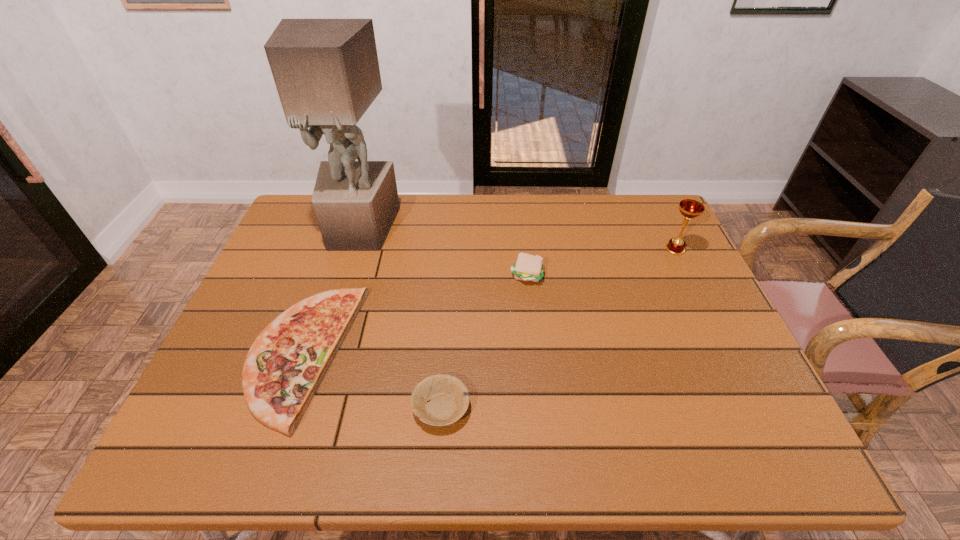
Locate an element on the screen. the tallest object is located at coordinates (326, 71).

Locate an element on the screen. The width and height of the screenshot is (960, 540). the fourth shortest object is located at coordinates (689, 208).

The height and width of the screenshot is (540, 960). What are the coordinates of `chalice` in the screenshot? It's located at (689, 208).

Find the location of `patty`. patty is located at coordinates pos(527,267).

At what (x,y) coordinates should I click in order to perform the action: click on the third farthest object. Please return your answer as a coordinate pair (x, y). Looking at the image, I should click on (527, 267).

Locate an element on the screen. pizza is located at coordinates (286, 363).

The width and height of the screenshot is (960, 540). What are the coordinates of `bowl` in the screenshot? It's located at (448, 398).

I want to click on the shortest object, so click(448, 398).

Locate an element on the screen. The image size is (960, 540). free space located 0.110m on the front-facing side of the tallest object is located at coordinates (345, 279).

Image resolution: width=960 pixels, height=540 pixels. Find the location of `free location located on the left of the chalice`. free location located on the left of the chalice is located at coordinates (613, 249).